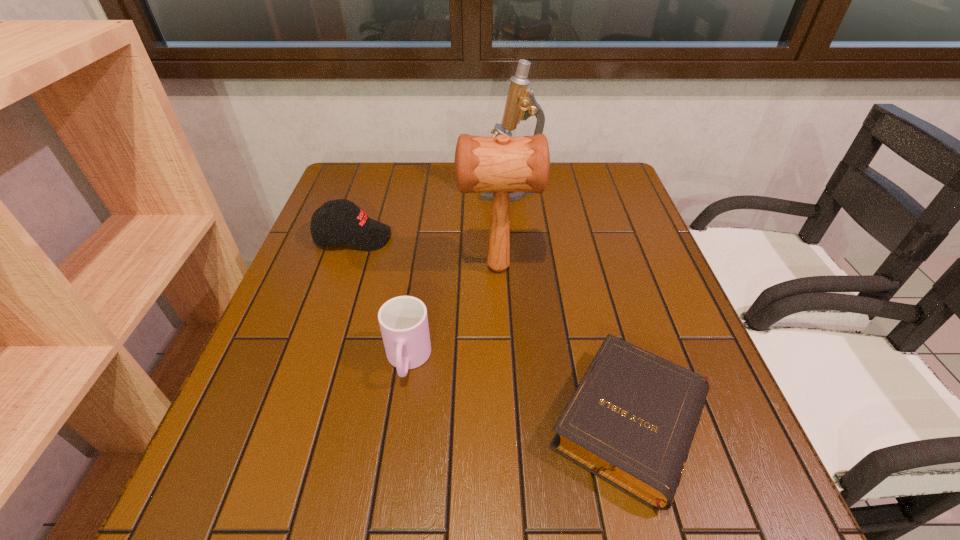
Identify the location of free point between the fourth object from right to left and the mallet. (453, 314).

Image resolution: width=960 pixels, height=540 pixels. I want to click on the closest object to the shortest object, so click(x=502, y=164).

The height and width of the screenshot is (540, 960). Find the location of `the second closest object to the mallet`. the second closest object to the mallet is located at coordinates (338, 221).

This screenshot has height=540, width=960. What are the coordinates of `vacant point that satisfies the following two spatial constraints: 1. with the handle on the side of the cup; 2. on the right side of the Bible` in the screenshot? It's located at (398, 423).

The image size is (960, 540). What are the coordinates of `vacant point that satisfies the following two spatial constraints: 1. with the handle on the side of the cup; 2. on the left side of the Bible` in the screenshot? It's located at (398, 423).

In order to click on blank area in the image that satisfies the following two spatial constraints: 1. on the strike surface of the Bible; 2. on the right side of the mallet in this screenshot , I will do `click(505, 423)`.

Where is `free point that satisfies the following two spatial constraints: 1. on the strike surface of the mallet; 2. on the back side of the Bible`? free point that satisfies the following two spatial constraints: 1. on the strike surface of the mallet; 2. on the back side of the Bible is located at coordinates (505, 423).

The height and width of the screenshot is (540, 960). I want to click on blank area in the image that satisfies the following two spatial constraints: 1. on the strike surface of the mallet; 2. on the right side of the Bible, so click(505, 423).

Where is `free space that satisfies the following two spatial constraints: 1. on the strike surface of the shortest object; 2. on the right side of the mallet`? This screenshot has height=540, width=960. free space that satisfies the following two spatial constraints: 1. on the strike surface of the shortest object; 2. on the right side of the mallet is located at coordinates (505, 423).

Find the location of a particular element. The height and width of the screenshot is (540, 960). vacant area in the image that satisfies the following two spatial constraints: 1. on the strike surface of the mallet; 2. with the handle on the side of the cup is located at coordinates (502, 361).